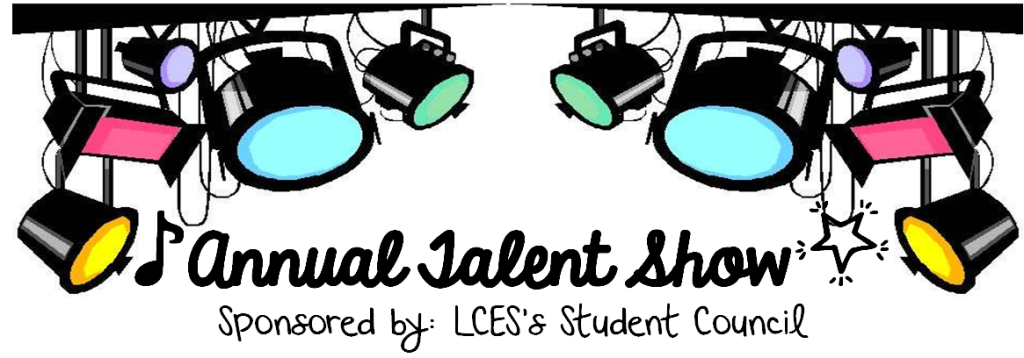
The image size is (1024, 358). I want to click on yellow light, so click(97, 245).